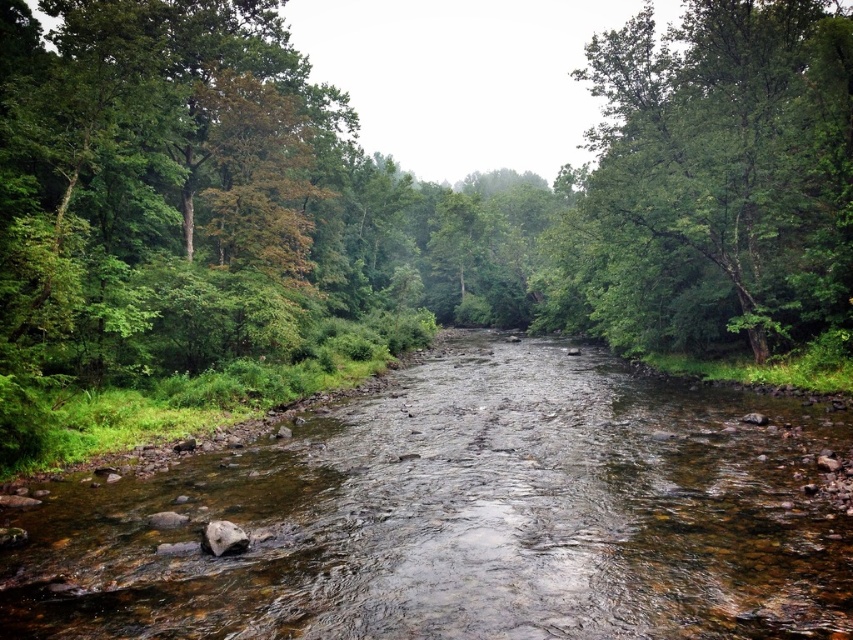
You are standing at the center of the image. Which direction should you move to reach the green leafy forest at center?

The green leafy forest at center is already at the center of the image, so you are already there.

You are standing at the edge of the river and want to walk to the green leafy tree at right. Which direction should you head from the smooth gray rock at lower left?

The green leafy tree at right is positioned on the right side of smooth gray rock at lower left, so you should head to the right from the smooth gray rock at lower left to reach the green leafy tree at right.

You are a hiker who wants to cross the river. You see the clear water at center and the green leafy tree at right. Which object is larger in size?

The green leafy tree at right is larger in size compared to the clear water at center.